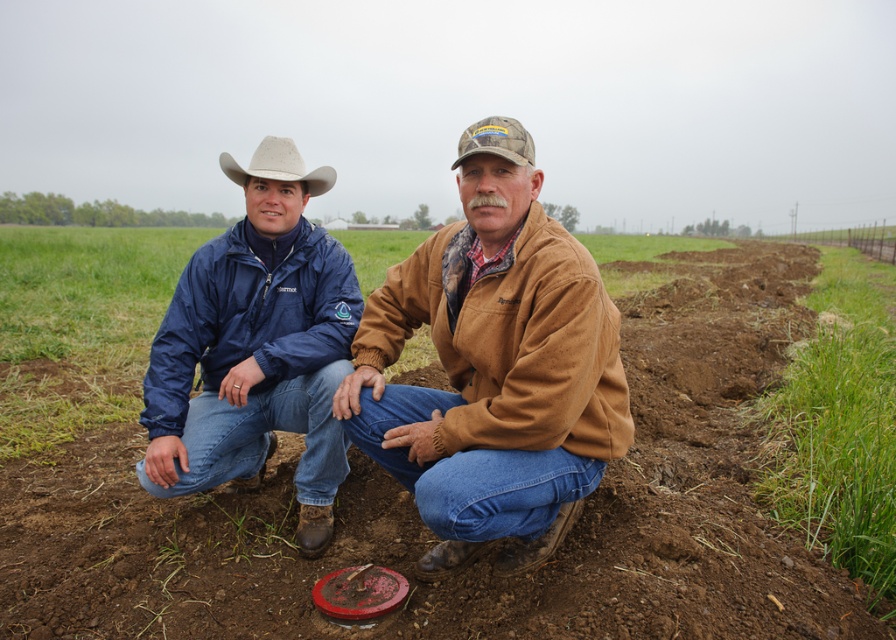
You are a photographer planning to take a portrait of the two people in the scene. You want to ensure that both the brown suede jacket at center and the white felt cowboy hat at upper left are clearly visible in the frame. Considering their sizes, which object should you focus on to ensure both are in focus?

The brown suede jacket at center is much taller than the white felt cowboy hat at upper left. To ensure both are in focus, you should focus on the brown suede jacket at center since it is larger and closer to the camera, making it easier to capture both objects within the depth of field.

You are standing in the field and see the brown suede jacket at center. If you move 0.1 units to the right along the horizontal axis, will you be closer to the jacket?

The 2D location of brown suede jacket at center is at point (x=493, y=376). Moving 0.1 units to the right along the horizontal axis would increase your x coordinate by 0.1. Since the jacket is at 0.588 on the x axis, moving right would take you away from it, so you would be further away. Therefore, no, you would not be closer to the jacket.

You are standing in a field and want to reach the location marked by the point at coordinates point (134, 572). If your walking speed is 3 feet per second, how many seconds will it take you to reach the point?

The distance between you and the point (134, 572) is 8.25 feet. At a speed of 3 feet per second, it will take 8.25 divided by 3, which equals 2.75 seconds to reach the point.